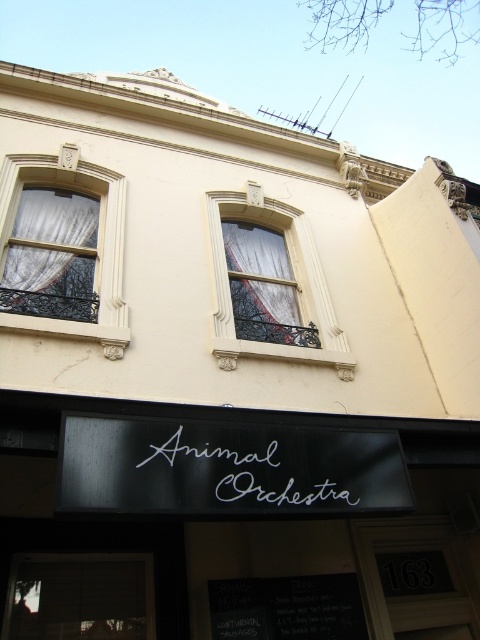
You are a window cleaner standing on a ladder. You need to clean both the black matte signboard at center and the white script at center. Which one will require you to climb higher on the ladder?

The black matte signboard at center is taller than the white script at center, so you will need to climb higher to reach the black matte signboard at center.

In the scene shown: You are standing outside the Animal Orchestra building and want to see the view through the windows. Which curtain, the white textured curtain at upper left or the white sheer curtain at center, is positioned higher up?

The white textured curtain at upper left is positioned higher up than the white sheer curtain at center.